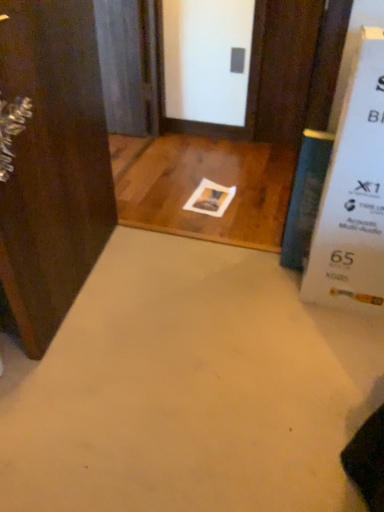
This screenshot has height=512, width=384. What do you see at coordinates (128, 65) in the screenshot? I see `blue glass screen door at upper left` at bounding box center [128, 65].

Find the location of a particular element. The height and width of the screenshot is (512, 384). blue glass screen door at upper left is located at coordinates (128, 65).

Can you tell me how much blue glass screen door at upper left and brown wood door at upper center, acting as the first door starting from the top, differ in facing direction?

The facing directions of blue glass screen door at upper left and brown wood door at upper center, acting as the first door starting from the top, are 0.614 degrees apart.

Does point (116, 123) lie behind point (304, 64)?

Yes, it is.

Is blue glass screen door at upper left taller than brown wood door at upper center, which is the 1th door in right-to-left order?

Incorrect, the height of blue glass screen door at upper left is not larger of that of brown wood door at upper center, which is the 1th door in right-to-left order.

Image resolution: width=384 pixels, height=512 pixels. What are the coordinates of `screen door to the right of dark wood door at left, which appears as the first door when viewed from the left` in the screenshot? It's located at (128, 65).

Who is smaller, blue glass screen door at upper left or dark wood door at left, which is the second door in top-to-bottom order?

Smaller between the two is blue glass screen door at upper left.

Is blue glass screen door at upper left inside the boundaries of dark wood door at left, marked as the second door in a right-to-left arrangement, or outside?

blue glass screen door at upper left is spatially situated outside dark wood door at left, marked as the second door in a right-to-left arrangement.

Considering the points (99, 56) and (76, 96), which point is in front, point (99, 56) or point (76, 96)?

Point (76, 96)

Considering the positions of points (16, 34) and (255, 20), is point (16, 34) closer to camera compared to point (255, 20)?

Yes, point (16, 34) is in front of point (255, 20).

From the image's perspective, is dark wood door at left, the 2th door from the back, over brown wood door at upper center, the 2th door when ordered from bottom to top?

Incorrect, from the image's perspective, dark wood door at left, the 2th door from the back, is lower than brown wood door at upper center, the 2th door when ordered from bottom to top.

Based on the photo, is dark wood door at left, which appears as the first door when viewed from the left, facing away from brown wood door at upper center, the 2th door when ordered from bottom to top?

That's not correct — dark wood door at left, which appears as the first door when viewed from the left, is not looking away from brown wood door at upper center, the 2th door when ordered from bottom to top.

Is brown wood door at upper center, the 2th door when ordered from bottom to top, oriented towards dark wood door at left, the 2th door from the back?

No, brown wood door at upper center, the 2th door when ordered from bottom to top, is not turned towards dark wood door at left, the 2th door from the back.

Image resolution: width=384 pixels, height=512 pixels. In order to click on door beneath the dark wood door at left, which is the second door in top-to-bottom order (from a real-world perspective) in this screenshot , I will do (286, 68).

Does brown wood door at upper center, the second door positioned from the left, have a smaller size compared to dark wood door at left, which is the 1th door in bottom-to-top order?

Correct, brown wood door at upper center, the second door positioned from the left, occupies less space than dark wood door at left, which is the 1th door in bottom-to-top order.

Considering the sizes of objects brown wood door at upper center, the 2th door when ordered from bottom to top, and dark wood door at left, marked as the second door in a right-to-left arrangement, in the image provided, who is wider, brown wood door at upper center, the 2th door when ordered from bottom to top, or dark wood door at left, marked as the second door in a right-to-left arrangement,?

dark wood door at left, marked as the second door in a right-to-left arrangement.

Based on the photo, looking at the image, does dark wood door at left, acting as the 1th door starting from the front, seem bigger or smaller compared to blue glass screen door at upper left?

In the image, dark wood door at left, acting as the 1th door starting from the front, appears to be larger than blue glass screen door at upper left.

From a real-world perspective, which is physically below, dark wood door at left, which is the 1th door in bottom-to-top order, or blue glass screen door at upper left?

blue glass screen door at upper left, from a real-world perspective.

Considering the positions of objects dark wood door at left, marked as the second door in a right-to-left arrangement, and blue glass screen door at upper left in the image provided, who is behind, dark wood door at left, marked as the second door in a right-to-left arrangement, or blue glass screen door at upper left?

blue glass screen door at upper left is further from the camera.

From the image's perspective, who appears lower, dark wood door at left, the 2th door from the back, or blue glass screen door at upper left?

dark wood door at left, the 2th door from the back.

From a real-world perspective, is brown wood door at upper center, which appears as the first door when viewed from the back, under blue glass screen door at upper left?

No, from a real-world perspective, brown wood door at upper center, which appears as the first door when viewed from the back, is not below blue glass screen door at upper left.

Which object is closer to the camera, brown wood door at upper center, which appears as the first door when viewed from the back, or blue glass screen door at upper left?

brown wood door at upper center, which appears as the first door when viewed from the back, is closer to the camera.

Which object is positioned more to the left, brown wood door at upper center, which appears as the first door when viewed from the back, or blue glass screen door at upper left?

From the viewer's perspective, blue glass screen door at upper left appears more on the left side.

Where is `door on the right of blue glass screen door at upper left`? The height and width of the screenshot is (512, 384). door on the right of blue glass screen door at upper left is located at coordinates (286, 68).

Where is `screen door above the brown wood door at upper center, the 2th door from the front (from the image's perspective)`? The image size is (384, 512). screen door above the brown wood door at upper center, the 2th door from the front (from the image's perspective) is located at coordinates (128, 65).

This screenshot has width=384, height=512. Find the location of `door that appears on the left of blue glass screen door at upper left`. door that appears on the left of blue glass screen door at upper left is located at coordinates (53, 164).

Based on their spatial positions, is blue glass screen door at upper left or brown wood door at upper center, the 2th door when ordered from bottom to top, closer to dark wood door at left, which is the 1th door in bottom-to-top order?

Based on the image, blue glass screen door at upper left appears to be nearer to dark wood door at left, which is the 1th door in bottom-to-top order.

Looking at the image, which one is located closer to dark wood door at left, which is the second door in top-to-bottom order, brown wood door at upper center, which appears as the first door when viewed from the back, or blue glass screen door at upper left?

blue glass screen door at upper left is closer to dark wood door at left, which is the second door in top-to-bottom order.

Which object lies nearer to the anchor point blue glass screen door at upper left, dark wood door at left, which is the 1th door in bottom-to-top order, or brown wood door at upper center, the 2th door when ordered from bottom to top?

brown wood door at upper center, the 2th door when ordered from bottom to top, is closer to blue glass screen door at upper left.

From the image, which object appears to be farther from brown wood door at upper center, the 2th door when ordered from bottom to top, dark wood door at left, which is the 1th door in bottom-to-top order, or blue glass screen door at upper left?

dark wood door at left, which is the 1th door in bottom-to-top order, is positioned further to the anchor brown wood door at upper center, the 2th door when ordered from bottom to top.

From the image, which object appears to be nearer to blue glass screen door at upper left, brown wood door at upper center, which is the 1th door in right-to-left order, or dark wood door at left, which is the second door in top-to-bottom order?

Based on the image, brown wood door at upper center, which is the 1th door in right-to-left order, appears to be nearer to blue glass screen door at upper left.

Which object lies further to the anchor point brown wood door at upper center, which appears as the first door when viewed from the back, blue glass screen door at upper left or dark wood door at left, which appears as the first door when viewed from the left?

dark wood door at left, which appears as the first door when viewed from the left, is further to brown wood door at upper center, which appears as the first door when viewed from the back.

Locate an element on the screen. door between dark wood door at left, acting as the 1th door starting from the front, and blue glass screen door at upper left in the front-back direction is located at coordinates (286, 68).